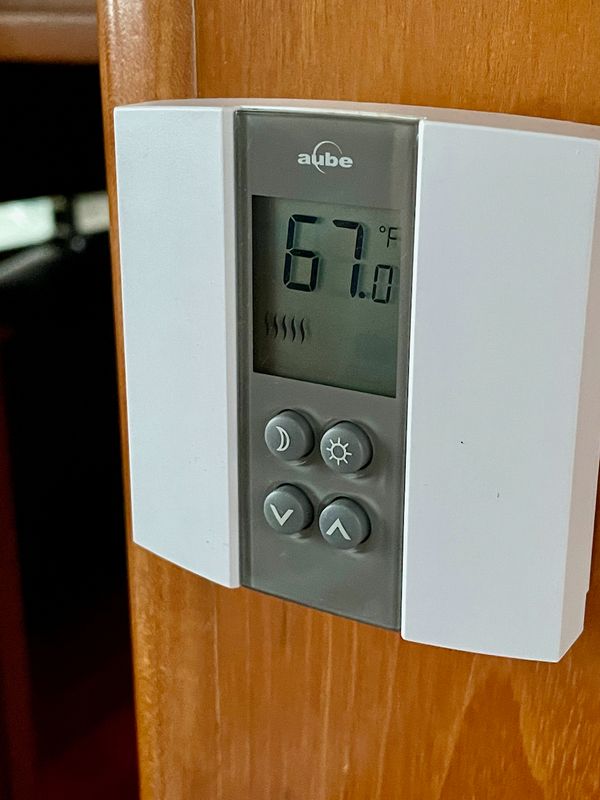
The height and width of the screenshot is (800, 600). I want to click on wood grain wall, so click(x=316, y=672).